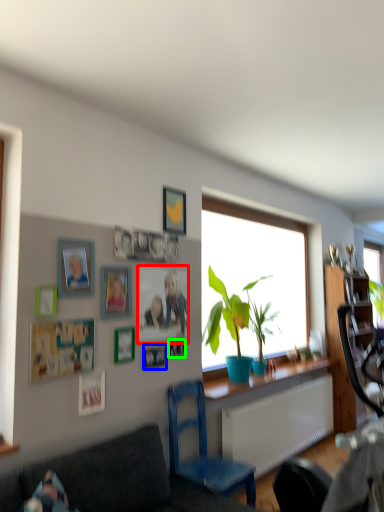
Question: Which object is positioned farthest from picture frame (highlighted by a red box)? Select from picture frame (highlighted by a blue box) and picture frame (highlighted by a green box).

Choices:
 (A) picture frame
 (B) picture frame

Answer: (A)